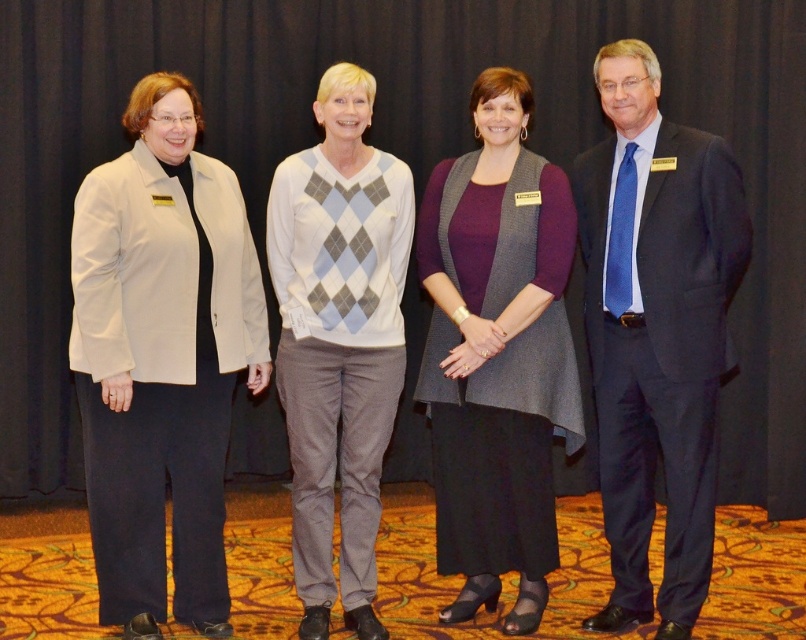
Question: Based on their relative distances, which object is nearer to the gray knit vest at center?

Choices:
 (A) beige fabric jacket at left
 (B) dark blue suit at right

Answer: (B)

Question: Can you confirm if dark blue suit at right is positioned to the left of gray knit vest at center?

Choices:
 (A) yes
 (B) no

Answer: (B)

Question: Which object is farther from the camera taking this photo?

Choices:
 (A) white argyle sweater at center
 (B) dark blue suit at right
 (C) gray knit vest at center

Answer: (C)

Question: Is beige fabric jacket at left above gray knit vest at center?

Choices:
 (A) no
 (B) yes

Answer: (A)

Question: Does dark blue suit at right appear under gray knit vest at center?

Choices:
 (A) yes
 (B) no

Answer: (B)

Question: Among these objects, which one is farthest from the camera?

Choices:
 (A) dark blue suit at right
 (B) white argyle sweater at center
 (C) beige fabric jacket at left

Answer: (B)